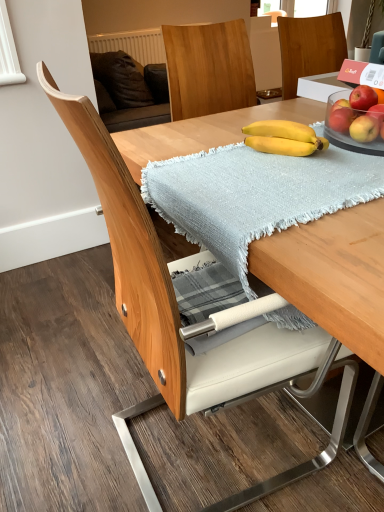
The image size is (384, 512). In order to click on free space to the left of red matte apple at upper right, the second apple from the top in this screenshot , I will do `click(324, 139)`.